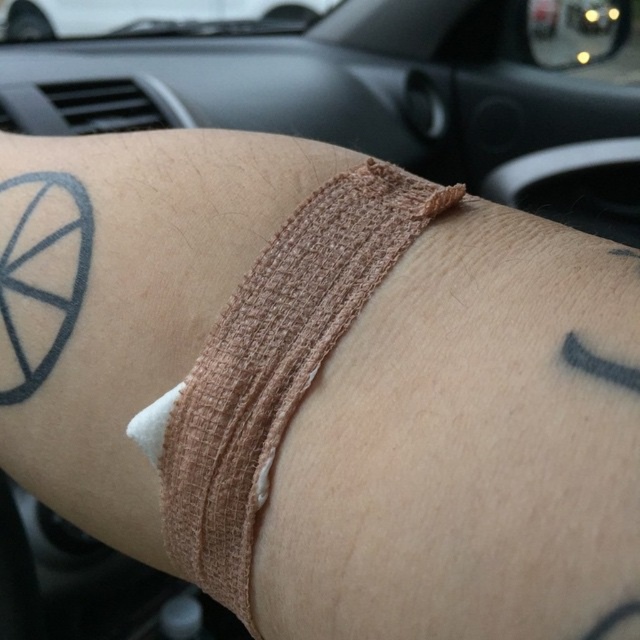
You are a passenger in a car and notice the beige fabric bandage at center on your forearm. If the car has a touchscreen infotainment system located at point 0.6, 0.4, can you reach it without moving your arm?

The beige fabric bandage at center is located at point (273, 365), which is very close to the touchscreen infotainment system at (256, 384). Since the coordinates are nearly the same, you can likely reach it without moving your arm.

Looking at this image, you are a passenger in a car and notice the beige fabric bandage at center and the white matte car at upper center in the car interior. Which object is positioned lower in the car?

The beige fabric bandage at center is located below the white matte car at upper center, so the beige fabric bandage at center is positioned lower in the car.